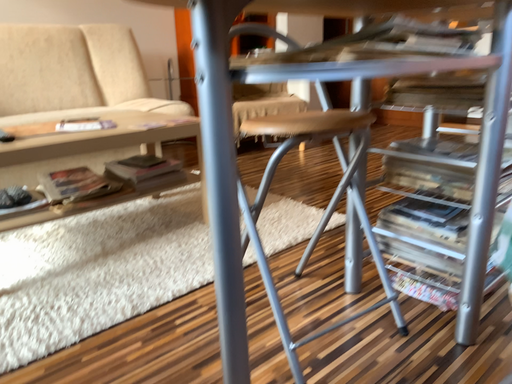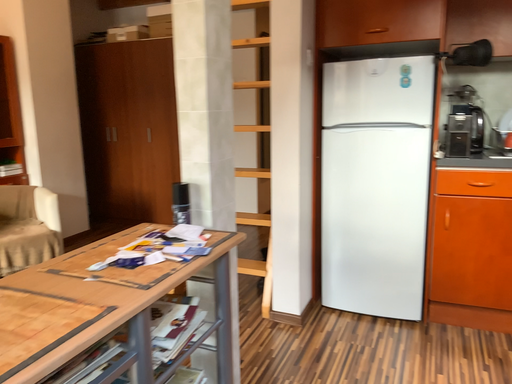
Question: Which way did the camera rotate in the video?

Choices:
 (A) rotated right
 (B) rotated left

Answer: (A)